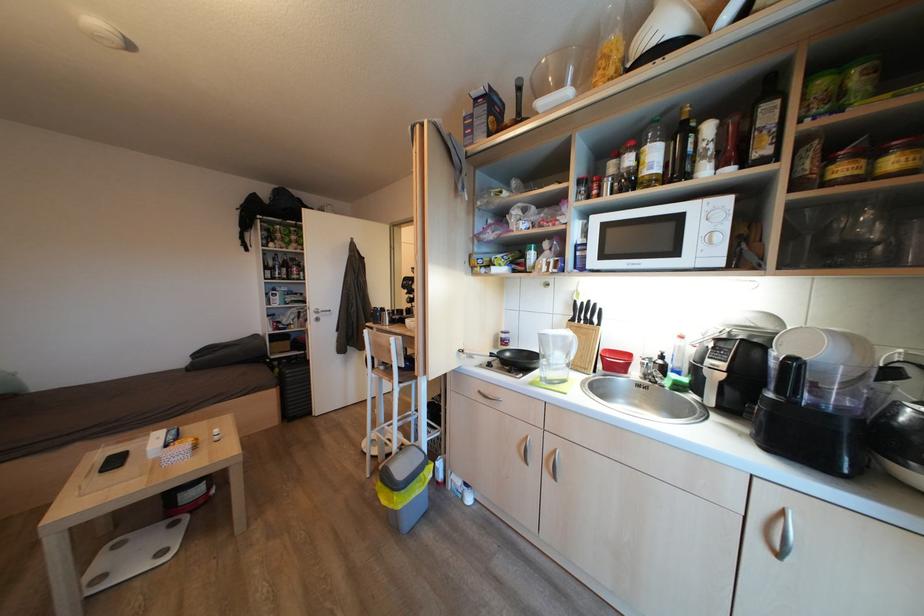
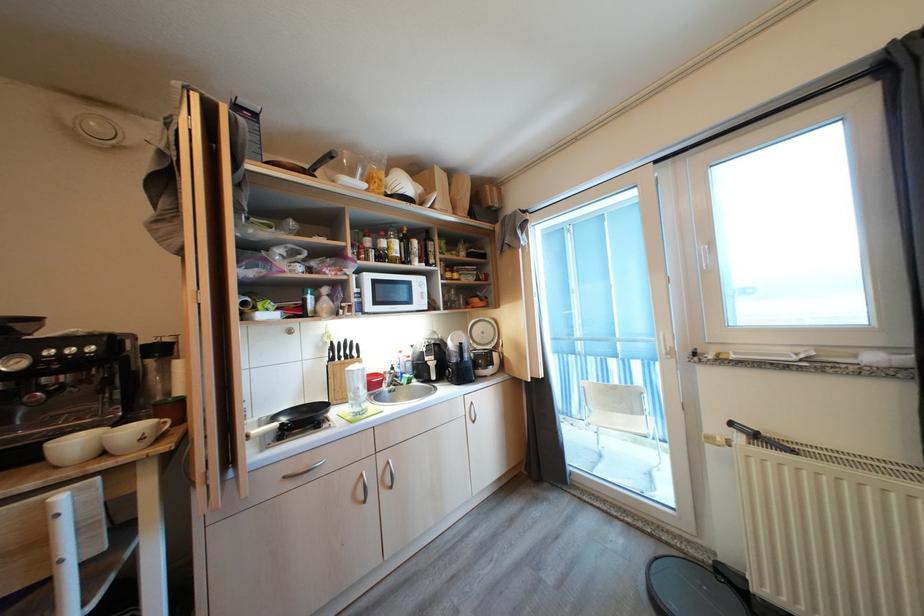
Question: The camera is either moving clockwise (left) or counter-clockwise (right) around the object. The first image is from the beginning of the video and the second image is from the end. Is the camera moving left or right when shooting the video?

Choices:
 (A) Left
 (B) Right

Answer: (A)